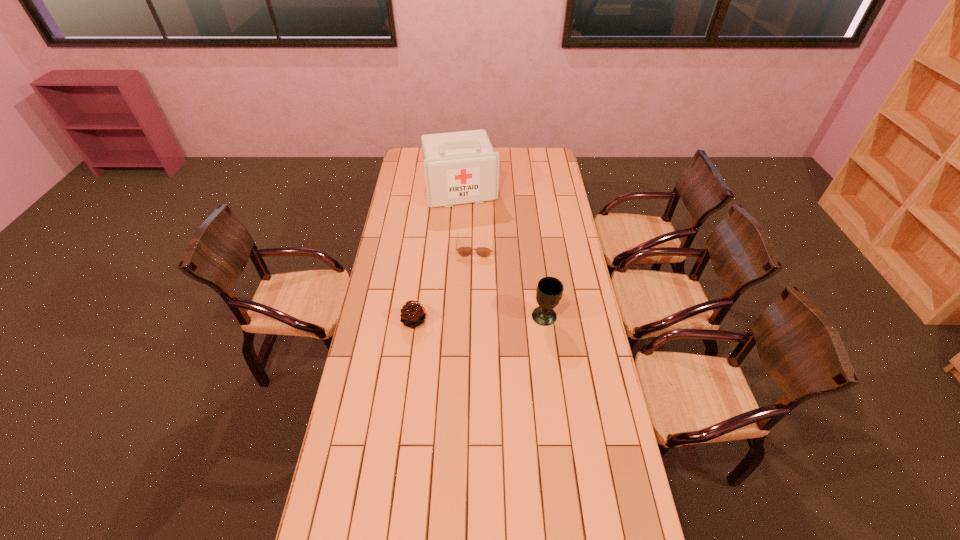
This screenshot has height=540, width=960. In the image, there is a desktop. Identify the location of free space at the right edge. (532, 173).

Locate an element on the screen. This screenshot has height=540, width=960. blank space at the far left corner of the desktop is located at coordinates (407, 153).

The image size is (960, 540). I want to click on blank space at the near left corner of the desktop, so click(x=324, y=524).

At what (x,y) coordinates should I click in order to perform the action: click on free location at the far right corner. Please return your answer as a coordinate pair (x, y). The height and width of the screenshot is (540, 960). Looking at the image, I should click on (536, 156).

The width and height of the screenshot is (960, 540). In order to click on blank area at the near right corner in this screenshot , I will do `click(621, 516)`.

Image resolution: width=960 pixels, height=540 pixels. In order to click on free space that is in between the chalice and the shortest object in this screenshot , I will do click(510, 281).

Identify the location of vacant area between the chalice and the first-aid kit. (503, 253).

Where is `free space between the pinecone and the shortest object`? This screenshot has width=960, height=540. free space between the pinecone and the shortest object is located at coordinates (446, 282).

You are a GUI agent. You are given a task and a screenshot of the screen. Output one action in this format:
    pyautogui.click(x=<x>, y=<y>)
    Task: Click on the vacant point located between the chalice and the sunglasses
    This screenshot has height=540, width=960.
    Given the screenshot: What is the action you would take?
    pyautogui.click(x=510, y=281)

Find the location of `the closest object to the first-aid kit`. the closest object to the first-aid kit is located at coordinates (464, 251).